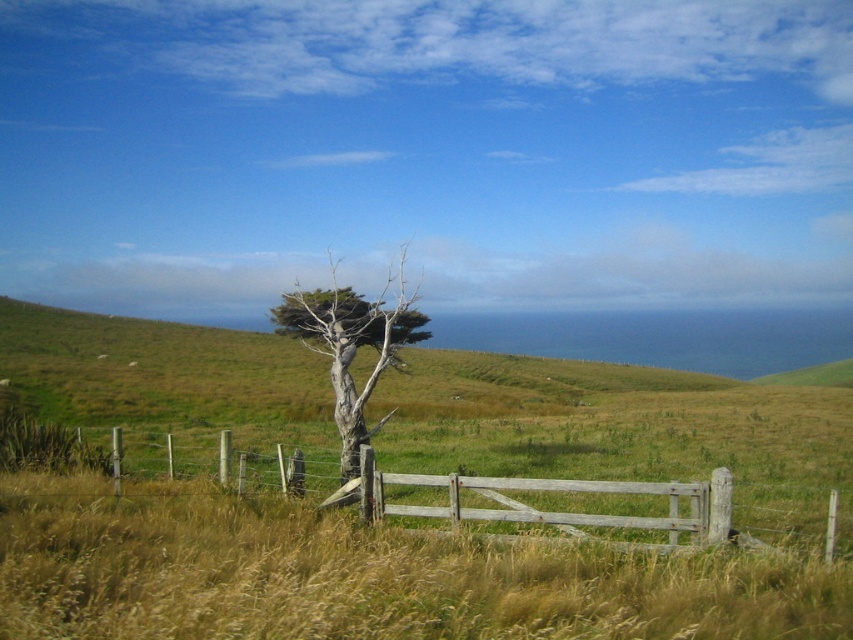
Does point (396, 484) come farther from viewer compared to point (384, 417)?

That is False.

Can you confirm if weathered wood gate at center is shorter than gray textured tree at center?

Yes.

Locate an element on the screen. The image size is (853, 640). weathered wood gate at center is located at coordinates (654, 513).

You are a GUI agent. You are given a task and a screenshot of the screen. Output one action in this format:
    pyautogui.click(x=<x>, y=<y>)
    Task: Click on the weathered wood gate at center
    The width and height of the screenshot is (853, 640).
    Given the screenshot: What is the action you would take?
    pyautogui.click(x=654, y=513)